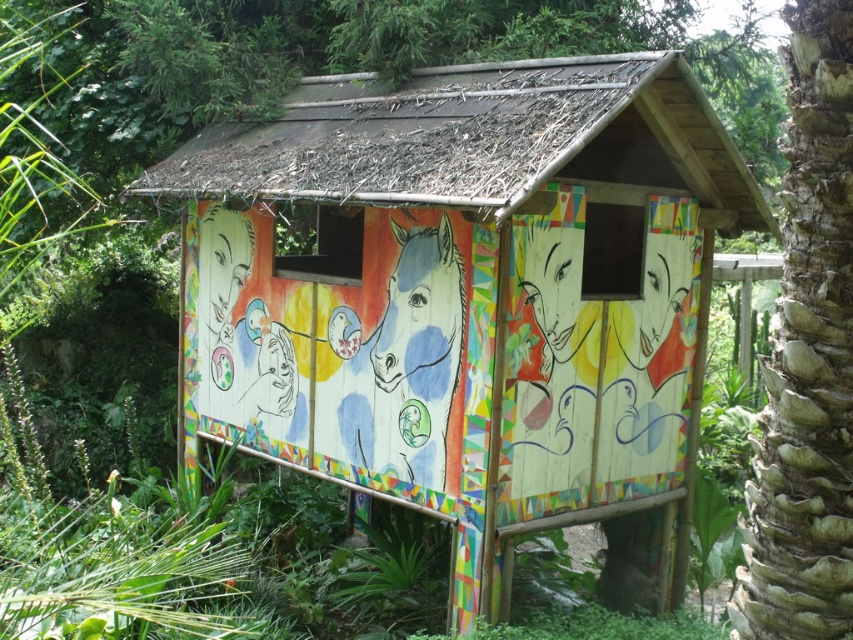
Does wooden hut at center have a lesser width compared to brown textured palm tree at right?

No.

Which is in front, point (392, 356) or point (827, 282)?

Point (827, 282) is in front.

Where is `wooden hut at center`? The width and height of the screenshot is (853, 640). wooden hut at center is located at coordinates (467, 296).